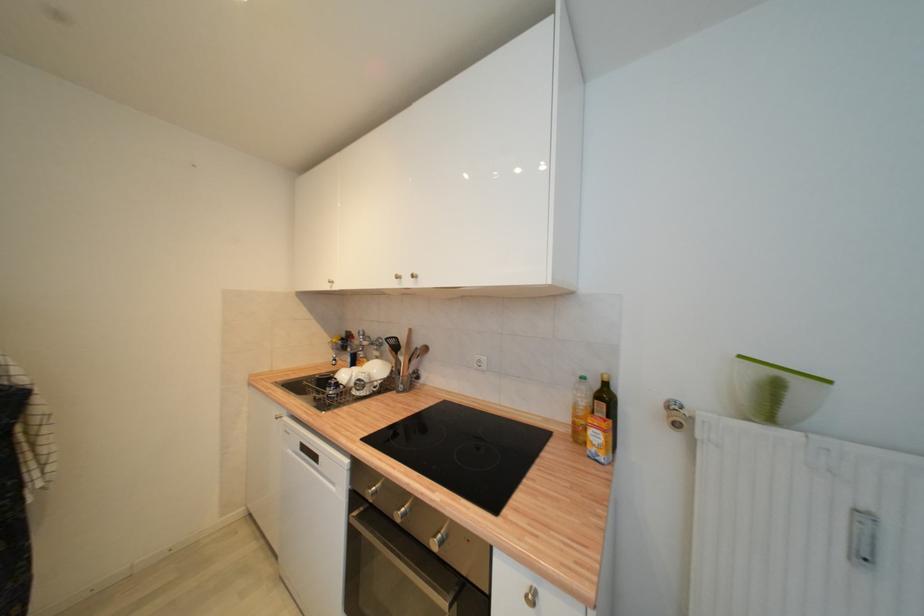
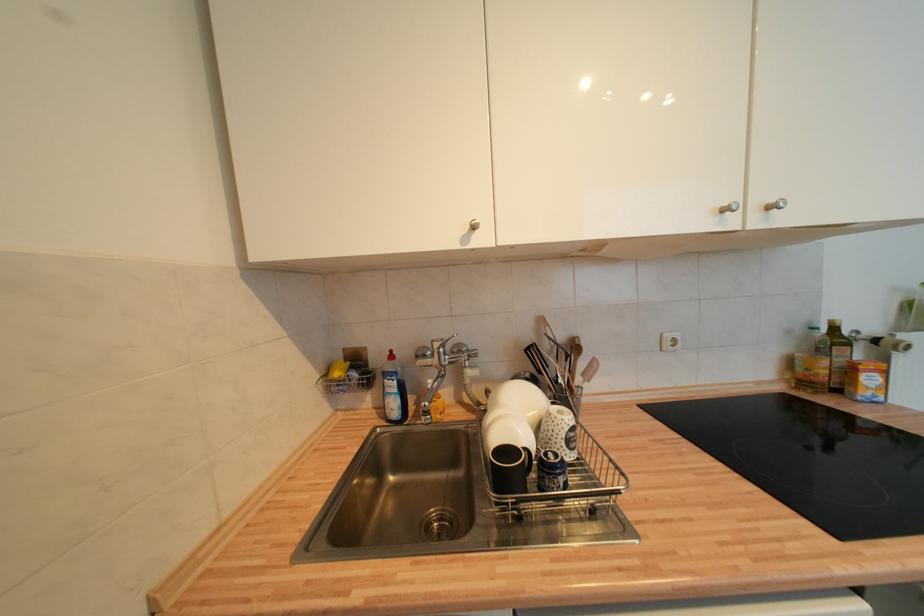
Where in the second image is the point corresponding to point (339, 342) from the first image?

(343, 376)